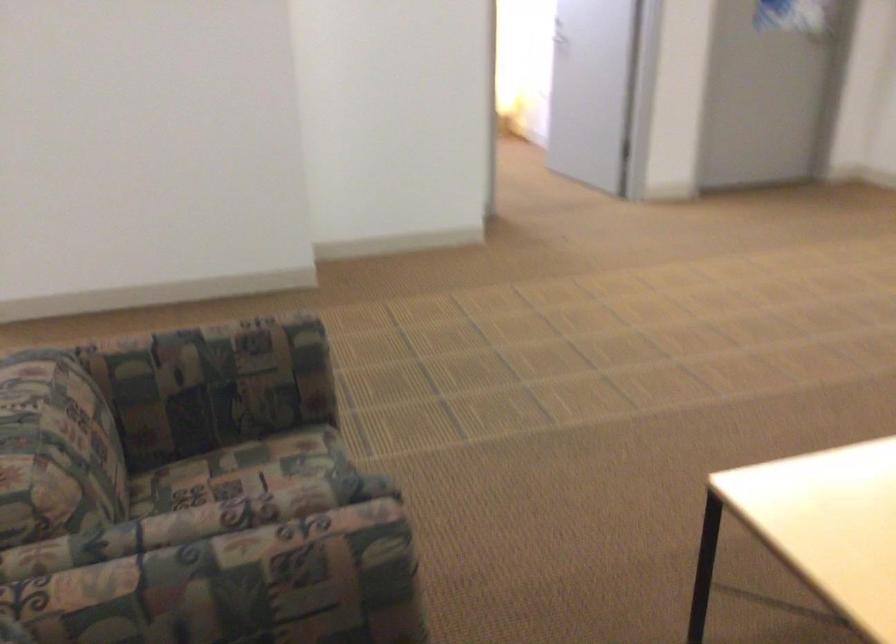
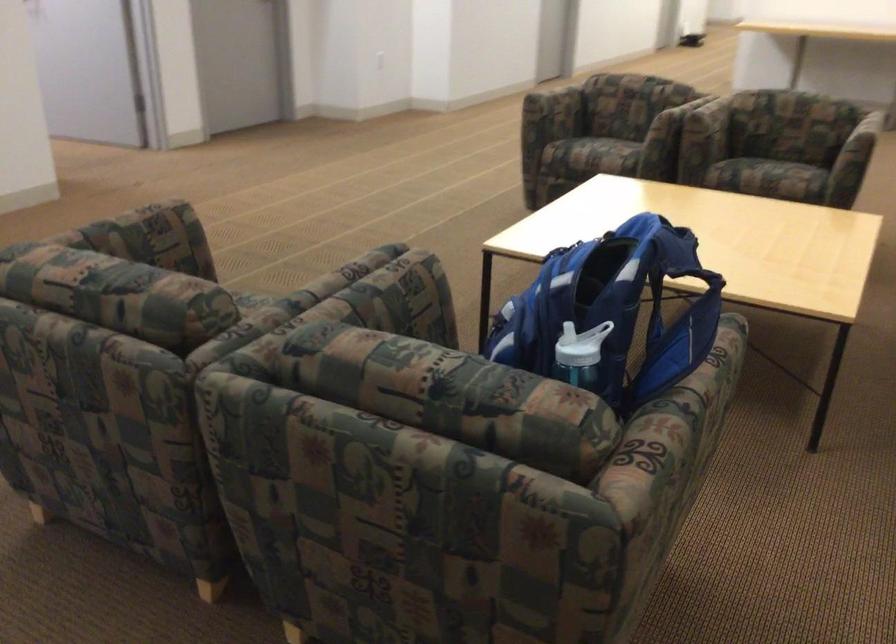
Where in the second image is the point corresponding to [309,462] from the first image?

(250, 298)